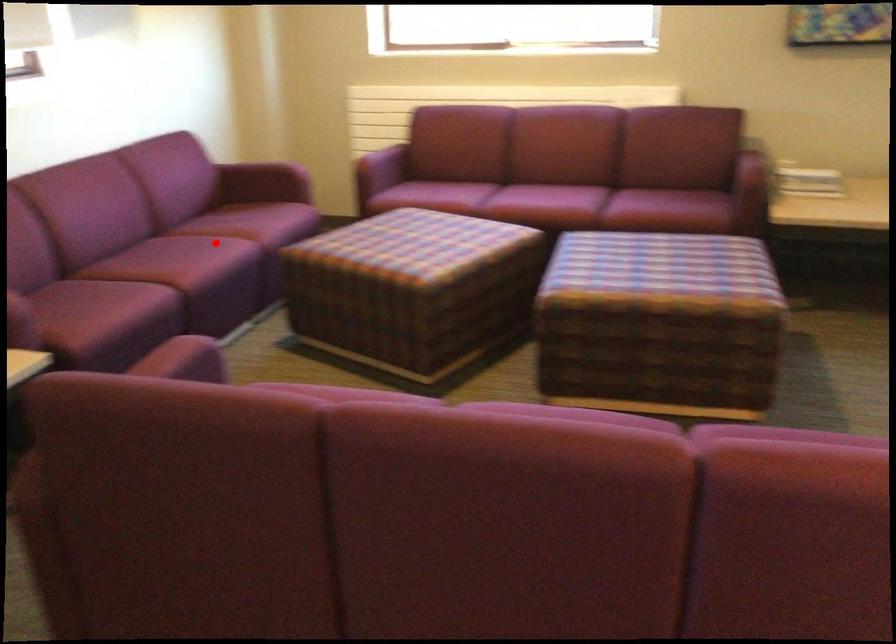
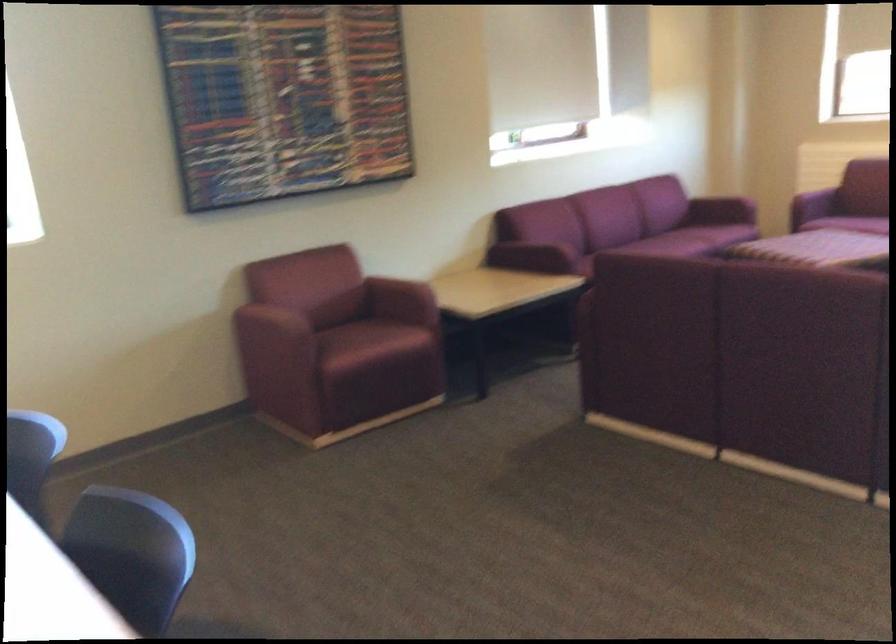
Question: A red point is marked in image1. In image2, is the corresponding 3D point closer to the camera or farther? Reply with the corresponding letter.

Choices:
 (A) The corresponding 3D point is closer.
 (B) The corresponding 3D point is farther.

Answer: (B)